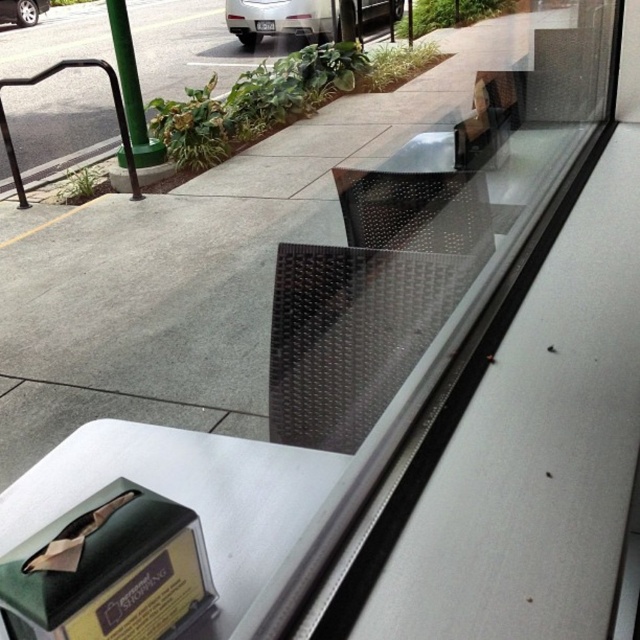
Question: Does green metal rail at upper left appear under silver metallic car wheel at upper left?

Choices:
 (A) yes
 (B) no

Answer: (A)

Question: Based on their relative distances, which object is farther from the silver metallic car at upper center?

Choices:
 (A) silver metallic car wheel at upper left
 (B) green metal rail at upper left

Answer: (A)

Question: Is silver metallic car at upper center positioned in front of silver metallic car wheel at upper left?

Choices:
 (A) no
 (B) yes

Answer: (B)

Question: Which point is farther to the camera?

Choices:
 (A) (374, 10)
 (B) (13, 3)

Answer: (B)

Question: Can you confirm if silver metallic car at upper center is bigger than green metal rail at upper left?

Choices:
 (A) yes
 (B) no

Answer: (B)

Question: Which object is the closest to the green metal rail at upper left?

Choices:
 (A) silver metallic car wheel at upper left
 (B) silver metallic car at upper center

Answer: (B)